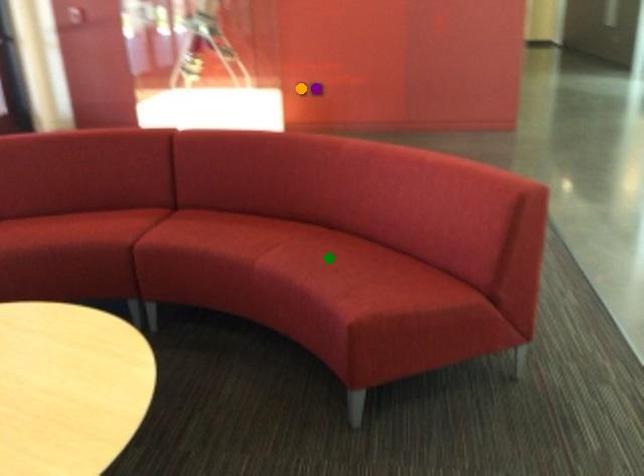
Order these from nearest to farthest:
orange point
green point
purple point

green point, orange point, purple point